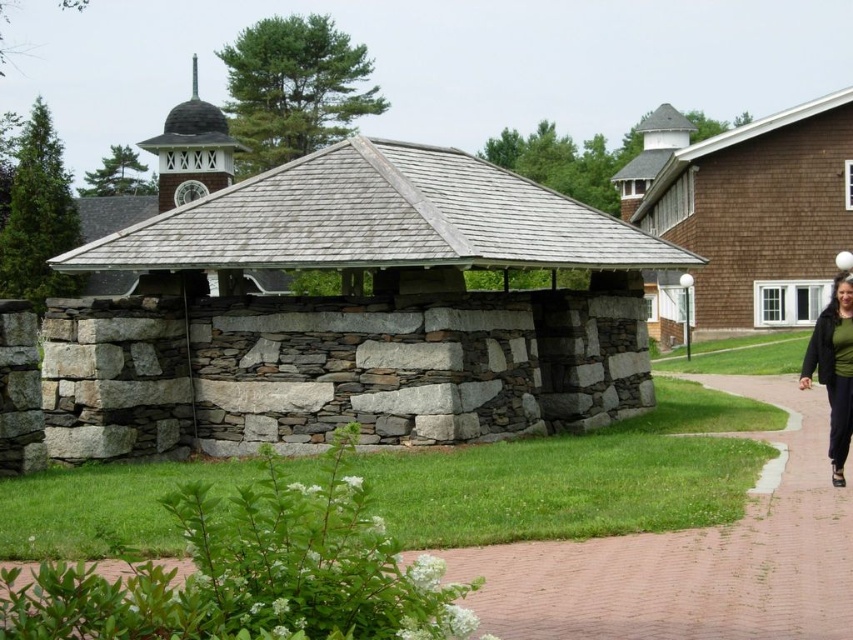
You are standing at the entrance of the larger building and want to walk to the gray stone gazebo at center. Which direction should you walk relative to the brick pavement at lower center?

The gray stone gazebo at center is located above the brick pavement at lower center, so you should walk towards the upper part of the brick pavement at lower center to reach the gazebo.